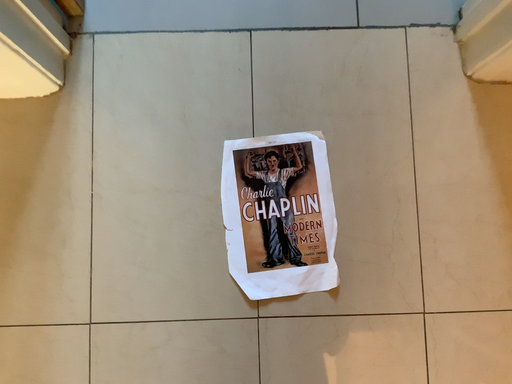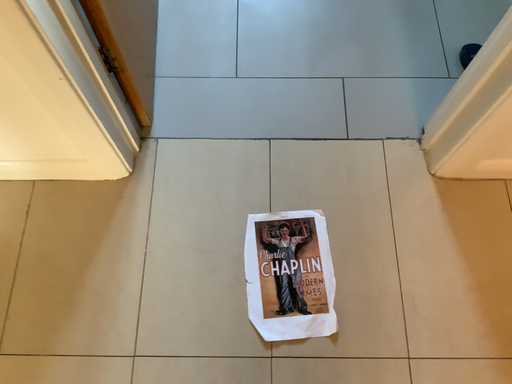
Question: Which way did the camera rotate in the video?

Choices:
 (A) rotated downward
 (B) rotated upward

Answer: (B)